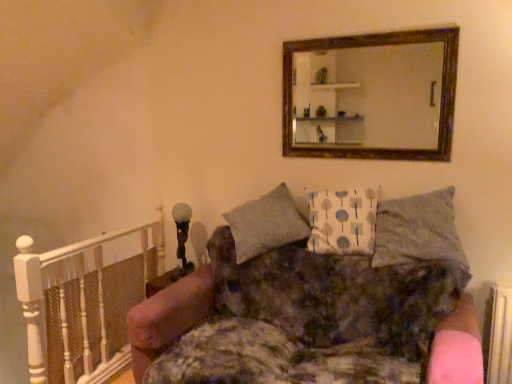
Question: From a real-world perspective, is wooden frame mirror at upper center located beneath velvet floral couch at center?

Choices:
 (A) no
 (B) yes

Answer: (A)

Question: Considering the relative sizes of wooden frame mirror at upper center and velvet floral couch at center in the image provided, is wooden frame mirror at upper center smaller than velvet floral couch at center?

Choices:
 (A) yes
 (B) no

Answer: (A)

Question: From the image's perspective, is wooden frame mirror at upper center under velvet floral couch at center?

Choices:
 (A) yes
 (B) no

Answer: (B)

Question: Does wooden frame mirror at upper center lie behind velvet floral couch at center?

Choices:
 (A) no
 (B) yes

Answer: (B)

Question: Can you confirm if wooden frame mirror at upper center is shorter than velvet floral couch at center?

Choices:
 (A) no
 (B) yes

Answer: (B)

Question: Based on their positions, is textured gray pillow at upper right, acting as the 2th pillow starting from the left, located to the left or right of white fabric pillow at center, the 1th pillow in the left-to-right sequence?

Choices:
 (A) left
 (B) right

Answer: (B)

Question: Is textured gray pillow at upper right, marked as the first pillow in a right-to-left arrangement, taller or shorter than white fabric pillow at center, which appears as the 2th pillow when viewed from the right?

Choices:
 (A) tall
 (B) short

Answer: (B)

Question: In the image, is textured gray pillow at upper right, marked as the first pillow in a right-to-left arrangement, positioned in front of or behind white fabric pillow at center, the 1th pillow in the left-to-right sequence?

Choices:
 (A) front
 (B) behind

Answer: (A)

Question: Based on their sizes in the image, would you say textured gray pillow at upper right, acting as the 2th pillow starting from the left, is bigger or smaller than white fabric pillow at center, the 1th pillow in the left-to-right sequence?

Choices:
 (A) big
 (B) small

Answer: (A)

Question: Is point (211, 281) positioned closer to the camera than point (414, 230)?

Choices:
 (A) closer
 (B) farther

Answer: (B)

Question: Is velvet floral couch at center bigger or smaller than textured gray pillow at upper right, marked as the first pillow in a right-to-left arrangement?

Choices:
 (A) small
 (B) big

Answer: (B)

Question: From the image's perspective, is velvet floral couch at center positioned above or below textured gray pillow at upper right, marked as the first pillow in a right-to-left arrangement?

Choices:
 (A) above
 (B) below

Answer: (B)

Question: Relative to textured gray pillow at upper right, marked as the first pillow in a right-to-left arrangement, is velvet floral couch at center in front or behind?

Choices:
 (A) front
 (B) behind

Answer: (A)

Question: Do you think white painted wood balustrade at left is within velvet floral couch at center, or outside of it?

Choices:
 (A) inside
 (B) outside

Answer: (B)

Question: In terms of size, does white painted wood balustrade at left appear bigger or smaller than velvet floral couch at center?

Choices:
 (A) small
 (B) big

Answer: (A)